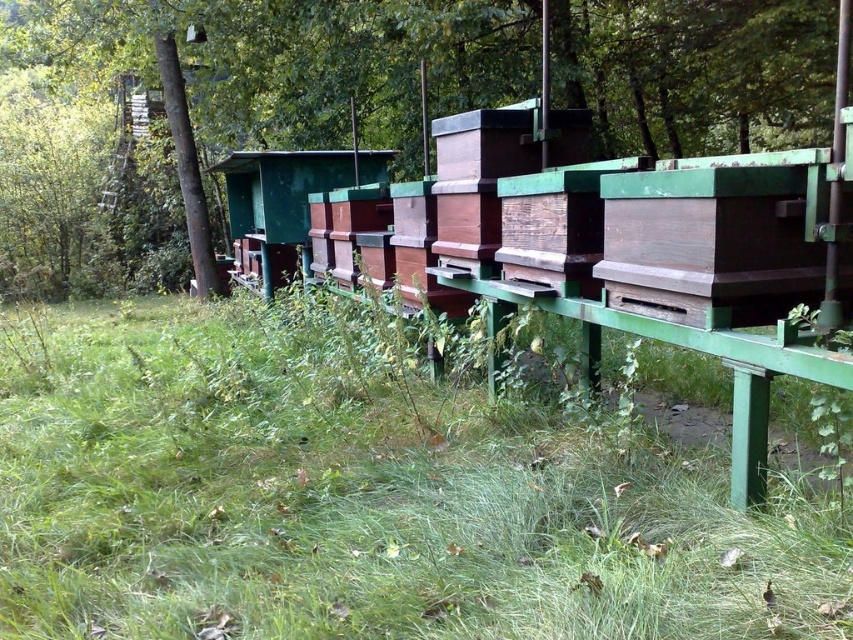
Question: Can you confirm if green grass at lower center is positioned to the left of green wood tree at center?

Choices:
 (A) no
 (B) yes

Answer: (A)

Question: Among these points, which one is nearest to the camera?

Choices:
 (A) (305, 561)
 (B) (531, 20)

Answer: (A)

Question: Among these objects, which one is farthest from the camera?

Choices:
 (A) green wood tree at center
 (B) green grass at lower center

Answer: (A)

Question: Is green grass at lower center behind green wood tree at center?

Choices:
 (A) no
 (B) yes

Answer: (A)

Question: Does green grass at lower center have a smaller size compared to green wood tree at center?

Choices:
 (A) yes
 (B) no

Answer: (A)

Question: Which object appears closest to the camera in this image?

Choices:
 (A) green wood tree at center
 (B) green grass at lower center

Answer: (B)